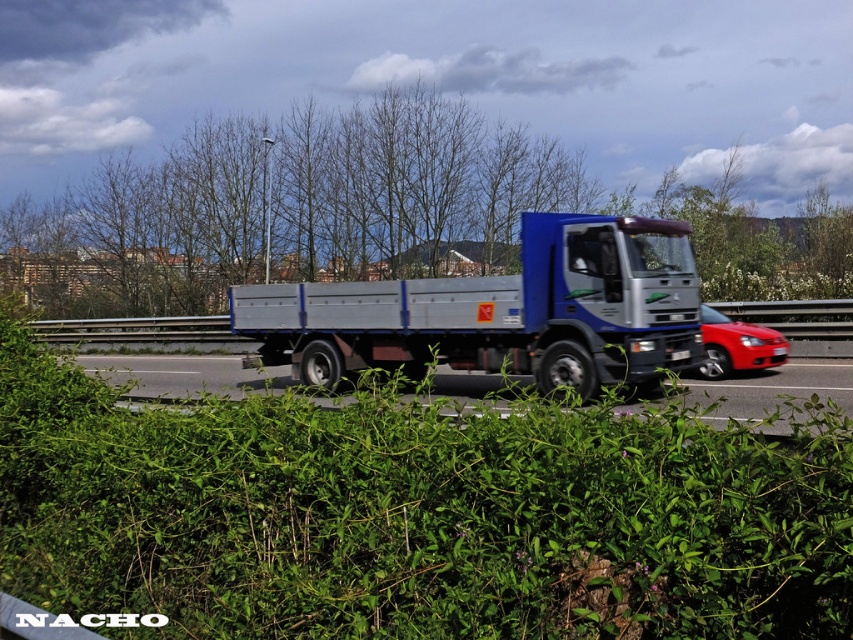
You are a photographer trying to capture a clear shot of the bare branches at center without the green leafy hedge at center blocking the view. What should you do?

Move your position so that the bare branches at center are no longer behind the green leafy hedge at center. Since the green leafy hedge at center is closer to the viewer, adjusting your angle or moving around it will allow you to see the bare branches at center clearly.

You are a drone operator trying to capture a photo of the highway scene. The camera is currently positioned at point 0.8, 0.5. To focus on the green leafy hedge at center, should you move the camera slightly to the left or right?

The green leafy hedge at center is at point (415, 515). Since the camera is at (426, 512), you should move it slightly to the right and down to align with the hedge.